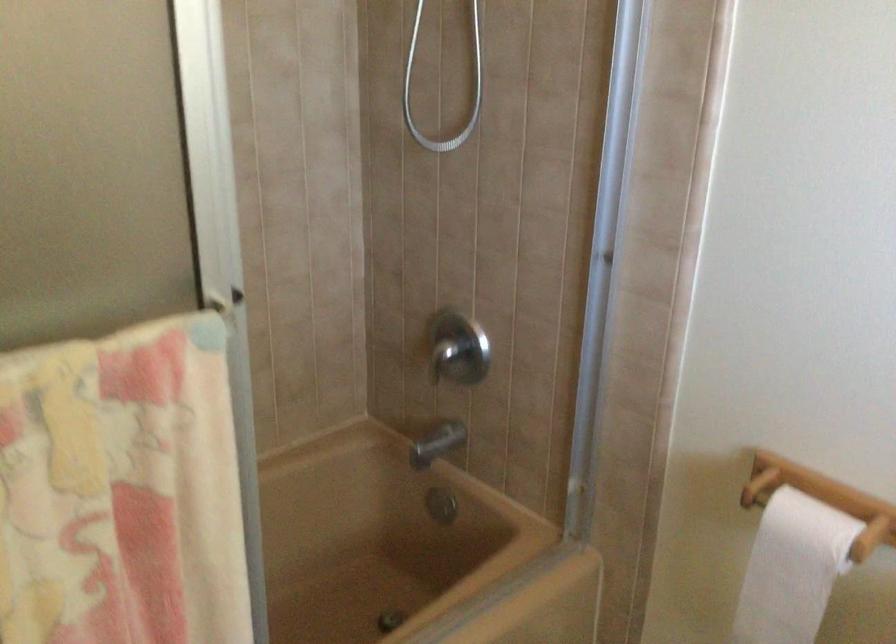
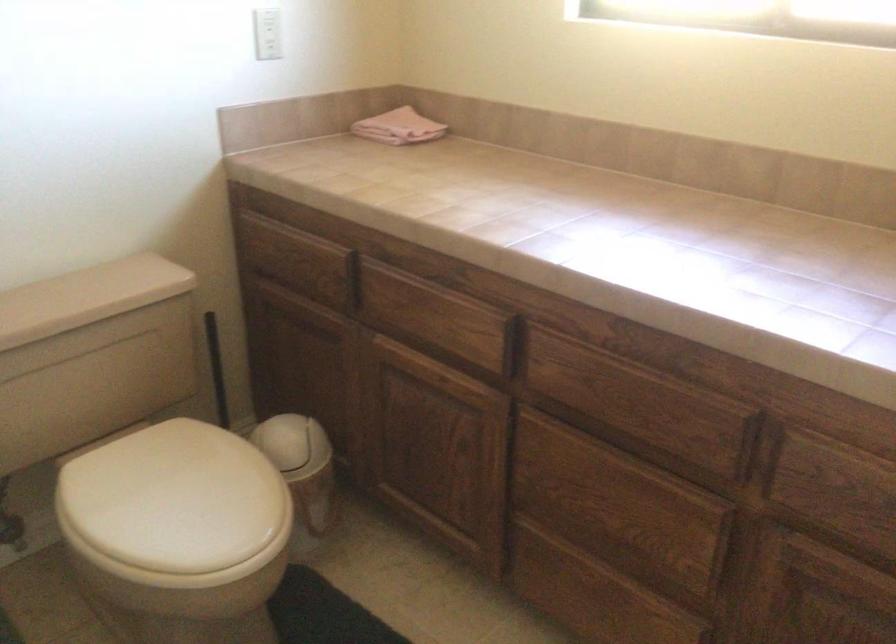
First-person continuous shooting, in which direction is the camera rotating?

The camera's rotation is toward right-down.